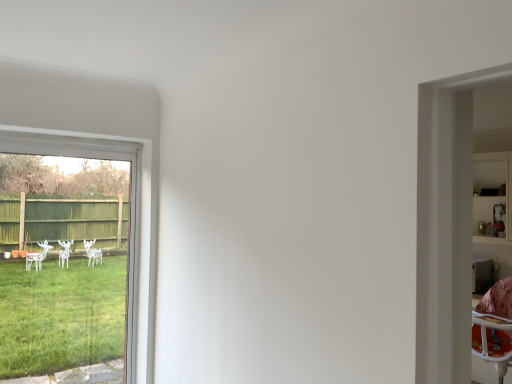
Identify the location of transparent glass window at left. Image resolution: width=512 pixels, height=384 pixels. (130, 216).

From the picture: In order to face transparent glass window at left, should I rotate leftwards or rightwards?

You should rotate left by 23.629 degrees.

Describe the element at coordinates (130, 216) in the screenshot. I see `transparent glass window at left` at that location.

What do you see at coordinates (493, 198) in the screenshot? The image size is (512, 384). I see `wooden shelf at right` at bounding box center [493, 198].

This screenshot has height=384, width=512. In order to click on wooden shelf at right in this screenshot , I will do `click(493, 198)`.

What is the approximate width of wooden shelf at right?

It is 33.64 centimeters.

Locate an element on the screen. transparent glass window at left is located at coordinates (130, 216).

Is transparent glass window at left at the right side of wooden shelf at right?

Incorrect, transparent glass window at left is not on the right side of wooden shelf at right.

Based on the photo, which is behind, transparent glass window at left or wooden shelf at right?

wooden shelf at right is further away from the camera.

Is point (129, 273) in front of point (489, 187)?

That is True.

From the image's perspective, is transparent glass window at left located beneath wooden shelf at right?

Indeed, from the image's perspective, transparent glass window at left is shown beneath wooden shelf at right.

From a real-world perspective, which object stands above the other?

wooden shelf at right is physically above.

Is transparent glass window at left wider than wooden shelf at right?

In fact, transparent glass window at left might be narrower than wooden shelf at right.

Can you confirm if transparent glass window at left is shorter than wooden shelf at right?

No.

Considering the sizes of objects transparent glass window at left and wooden shelf at right in the image provided, who is smaller, transparent glass window at left or wooden shelf at right?

transparent glass window at left is smaller.

Is transparent glass window at left not inside wooden shelf at right?

Yes.

In the scene shown: Does transparent glass window at left touch wooden shelf at right?

No, transparent glass window at left is not in contact with wooden shelf at right.

Is transparent glass window at left oriented away from wooden shelf at right?

transparent glass window at left is not turned away from wooden shelf at right.

Can you tell me how much transparent glass window at left and wooden shelf at right differ in facing direction?

The facing directions of transparent glass window at left and wooden shelf at right are 89.9 degrees apart.

In order to click on window below the wooden shelf at right (from a real-world perspective) in this screenshot , I will do `click(130, 216)`.

Is wooden shelf at right at the left side of transparent glass window at left?

In fact, wooden shelf at right is to the right of transparent glass window at left.

Is wooden shelf at right in front of or behind transparent glass window at left in the image?

Visually, wooden shelf at right is located behind transparent glass window at left.

Is point (493, 161) positioned before point (153, 297)?

No, (493, 161) is behind (153, 297).

From the image's perspective, relative to transparent glass window at left, is wooden shelf at right above or below?

wooden shelf at right is situated higher than transparent glass window at left in the image.

From a real-world perspective, does wooden shelf at right sit lower than transparent glass window at left?

No, from a real-world perspective, wooden shelf at right is not beneath transparent glass window at left.

Which of these two, wooden shelf at right or transparent glass window at left, is wider?

With larger width is wooden shelf at right.

Is wooden shelf at right shorter than transparent glass window at left?

Yes, wooden shelf at right is shorter than transparent glass window at left.

Can you confirm if wooden shelf at right is bigger than transparent glass window at left?

Yes, wooden shelf at right is bigger than transparent glass window at left.

Would you say wooden shelf at right is inside or outside transparent glass window at left?

wooden shelf at right cannot be found inside transparent glass window at left.

Is wooden shelf at right not near transparent glass window at left?

Yes, wooden shelf at right and transparent glass window at left are located far from each other.

Is wooden shelf at right facing towards transparent glass window at left?

Yes, wooden shelf at right is oriented towards transparent glass window at left.

Measure the distance from wooden shelf at right to transparent glass window at left.

wooden shelf at right and transparent glass window at left are 3.16 meters apart from each other.

Identify the location of shelf on the right of transparent glass window at left. (493, 198).

The image size is (512, 384). Find the location of `window in front of the wooden shelf at right`. window in front of the wooden shelf at right is located at coordinates (130, 216).

In order to click on shelf behind the transparent glass window at left in this screenshot , I will do `click(493, 198)`.